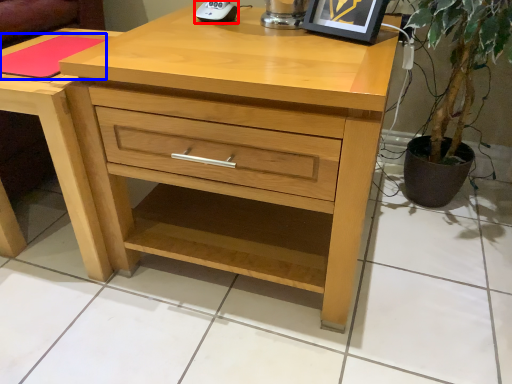
Question: Which object appears farthest to the camera in this image, gadget (highlighted by a red box) or pad (highlighted by a blue box)?

Choices:
 (A) gadget
 (B) pad

Answer: (A)